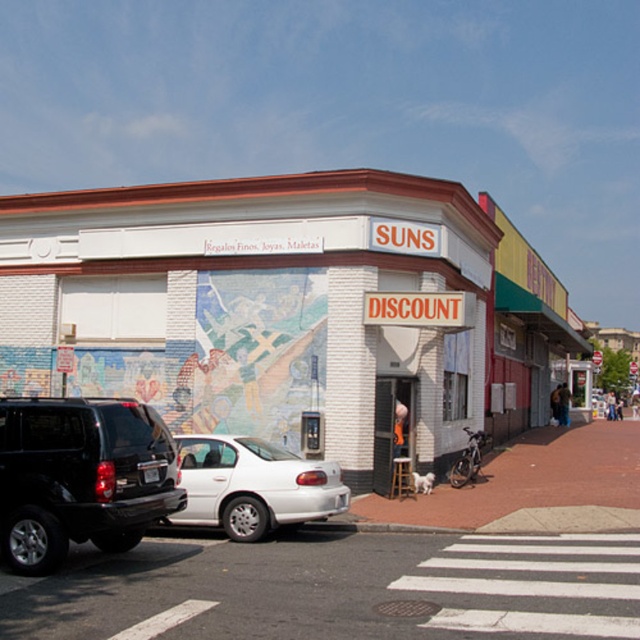
You are a pedestrian standing at the street corner and see the black matte suv at left and the white matte sedan at center. Which vehicle is nearer to you?

The black matte suv at left is closer to the viewer than the white matte sedan at center.

You are a delivery person who needs to park your vehicle in this street corner. You have a black matte suv at left and a white matte sedan at center. Which vehicle should you choose to park if you need to maximize the height available for loading a tall package?

The black matte suv at left is much taller than the white matte sedan at center, so you should choose the white matte sedan at center to park since it has lower height and allows more clearance for the tall package.